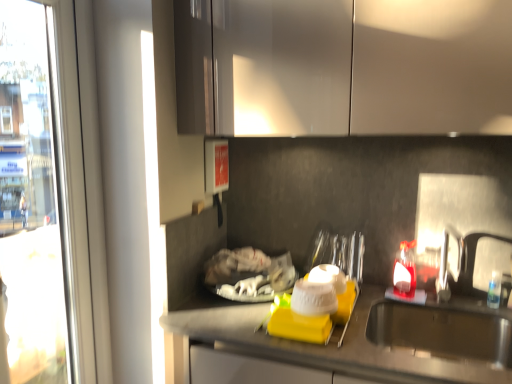
The image size is (512, 384). Describe the element at coordinates (405, 270) in the screenshot. I see `translucent glass bottle at right` at that location.

The image size is (512, 384). What do you see at coordinates (448, 317) in the screenshot?
I see `stainless steel sink at lower right` at bounding box center [448, 317].

You are a GUI agent. You are given a task and a screenshot of the screen. Output one action in this format:
    pyautogui.click(x=<x>, y=<y>)
    Task: Click on the glossy white cabinets at upper center
    
    Given the screenshot: What is the action you would take?
    pyautogui.click(x=343, y=67)

Would you say transparent glass window at left is to the left or to the right of glossy white cabinets at upper center in the picture?

In the image, transparent glass window at left appears on the left side of glossy white cabinets at upper center.

Which is in front, point (62, 104) or point (324, 82)?

The point (324, 82) is in front.

From a real-world perspective, is transparent glass window at left under glossy white cabinets at upper center?

Yes, from a real-world perspective, transparent glass window at left is beneath glossy white cabinets at upper center.

Which object is more forward, transparent glass window at left or glossy white cabinets at upper center?

transparent glass window at left is in front.

This screenshot has width=512, height=384. In order to click on window in front of the glossy white cabinets at upper center in this screenshot , I will do `click(83, 186)`.

How different are the orientations of glossy white cabinets at upper center and transparent glass window at left in degrees?

The angular difference between glossy white cabinets at upper center and transparent glass window at left is 90.6 degrees.

Would you say glossy white cabinets at upper center is to the left or to the right of transparent glass window at left in the picture?

glossy white cabinets at upper center is to the right of transparent glass window at left.

Is glossy white cabinets at upper center wider than transparent glass window at left?

Yes, glossy white cabinets at upper center is wider than transparent glass window at left.

Which of these two, satin nickel faucet at right or stainless steel sink at lower right, is wider?

stainless steel sink at lower right is wider.

Is satin nickel faucet at right further to camera compared to stainless steel sink at lower right?

That is True.

Looking at this image, can you tell me how much satin nickel faucet at right and stainless steel sink at lower right differ in facing direction?

satin nickel faucet at right and stainless steel sink at lower right are facing 6.47 degrees away from each other.

Considering the relative positions of satin nickel faucet at right and stainless steel sink at lower right in the image provided, is satin nickel faucet at right to the right of stainless steel sink at lower right from the viewer's perspective?

Yes.

Which is in front, point (112, 381) or point (448, 262)?

Positioned in front is point (448, 262).

Is transparent glass window at left oriented away from satin nickel faucet at right?

No, satin nickel faucet at right is not at the back of transparent glass window at left.

Considering the relative positions of transparent glass window at left and satin nickel faucet at right in the image provided, is transparent glass window at left to the right of satin nickel faucet at right from the viewer's perspective?

Incorrect, transparent glass window at left is not on the right side of satin nickel faucet at right.

Between translucent glass bottle at right and satin nickel faucet at right, which one appears on the right side from the viewer's perspective?

satin nickel faucet at right is more to the right.

Could satin nickel faucet at right be considered to be inside translucent glass bottle at right?

No, satin nickel faucet at right is not inside translucent glass bottle at right.

Looking at this image, is translucent glass bottle at right shorter than satin nickel faucet at right?

Yes, translucent glass bottle at right is shorter than satin nickel faucet at right.

Is translucent glass bottle at right far from satin nickel faucet at right?

translucent glass bottle at right is near satin nickel faucet at right, not far away.

Which is more to the right, translucent glass bottle at right or stainless steel sink at lower right?

stainless steel sink at lower right.

From a real-world perspective, is translucent glass bottle at right physically located above or below stainless steel sink at lower right?

From a real-world perspective, translucent glass bottle at right is physically above stainless steel sink at lower right.

Is translucent glass bottle at right inside the boundaries of stainless steel sink at lower right, or outside?

translucent glass bottle at right is located beyond the bounds of stainless steel sink at lower right.

Considering the sizes of objects translucent glass bottle at right and stainless steel sink at lower right in the image provided, who is thinner, translucent glass bottle at right or stainless steel sink at lower right?

Thinner between the two is translucent glass bottle at right.

In the image, is satin nickel faucet at right positioned in front of or behind transparent glass window at left?

satin nickel faucet at right is behind transparent glass window at left.

Is satin nickel faucet at right not within transparent glass window at left?

Yes, satin nickel faucet at right is outside of transparent glass window at left.

From the image's perspective, is satin nickel faucet at right positioned above or below transparent glass window at left?

Based on their image positions, satin nickel faucet at right is located beneath transparent glass window at left.

Does satin nickel faucet at right have a larger size compared to transparent glass window at left?

Incorrect, satin nickel faucet at right is not larger than transparent glass window at left.

At what (x,y) coordinates should I click in order to perform the action: click on cabinetry above the transparent glass window at left (from the image's perspective). Please return your answer as a coordinate pair (x, y). Image resolution: width=512 pixels, height=384 pixels. Looking at the image, I should click on (343, 67).

At what (x,y) coordinates should I click in order to perform the action: click on cabinetry above the transparent glass window at left (from a real-world perspective). Please return your answer as a coordinate pair (x, y). This screenshot has height=384, width=512. Looking at the image, I should click on (343, 67).

Considering their positions, is stainless steel sink at lower right positioned further to glossy white cabinets at upper center than transparent glass window at left?

stainless steel sink at lower right.

Estimate the real-world distances between objects in this image. Which object is further from satin nickel faucet at right, transparent glass window at left or glossy white cabinets at upper center?

Based on the image, transparent glass window at left appears to be further to satin nickel faucet at right.

Based on their spatial positions, is translucent glass bottle at right or stainless steel sink at lower right closer to glossy white cabinets at upper center?

stainless steel sink at lower right is positioned closer to the anchor glossy white cabinets at upper center.

Estimate the real-world distances between objects in this image. Which object is further from transparent glass window at left, satin nickel faucet at right or glossy white cabinets at upper center?

satin nickel faucet at right lies further to transparent glass window at left than the other object.

From the image, which object appears to be nearer to stainless steel sink at lower right, transparent glass window at left or satin nickel faucet at right?

satin nickel faucet at right is closer to stainless steel sink at lower right.

From the picture: Which object lies nearer to the anchor point glossy white cabinets at upper center, transparent glass window at left or translucent glass bottle at right?

transparent glass window at left.

Looking at the image, which one is located closer to glossy white cabinets at upper center, stainless steel sink at lower right or satin nickel faucet at right?

The object closer to glossy white cabinets at upper center is satin nickel faucet at right.

Which object lies further to the anchor point translucent glass bottle at right, satin nickel faucet at right or glossy white cabinets at upper center?

glossy white cabinets at upper center.

Locate an element on the screen. bottle between glossy white cabinets at upper center and stainless steel sink at lower right in the vertical direction is located at coordinates (405, 270).

Identify the location of faucet between stainless steel sink at lower right and translucent glass bottle at right from front to back. This screenshot has height=384, width=512. (448, 263).

Locate an element on the screen. Image resolution: width=512 pixels, height=384 pixels. cabinetry situated between transparent glass window at left and stainless steel sink at lower right from left to right is located at coordinates coord(343,67).

I want to click on bottle between transparent glass window at left and stainless steel sink at lower right from left to right, so click(x=405, y=270).